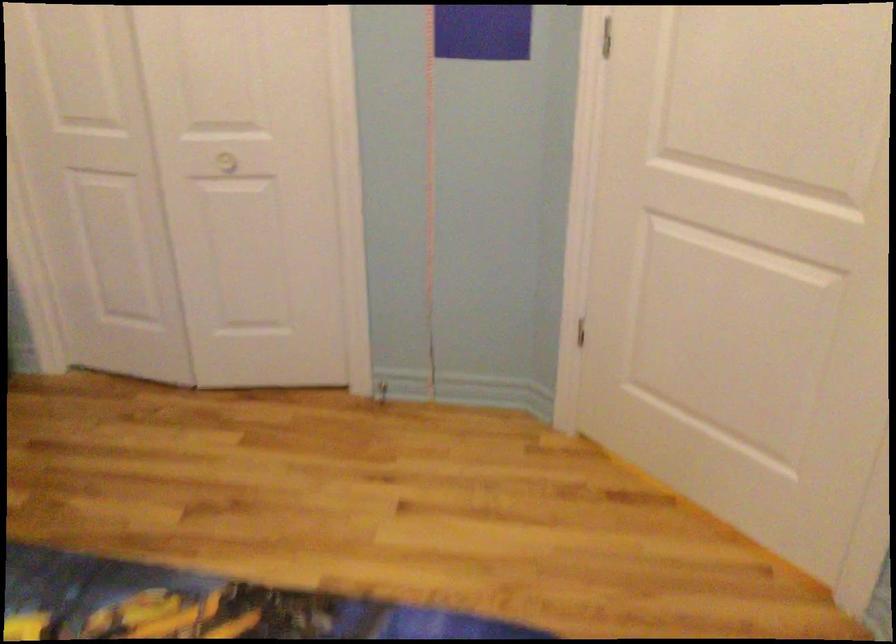
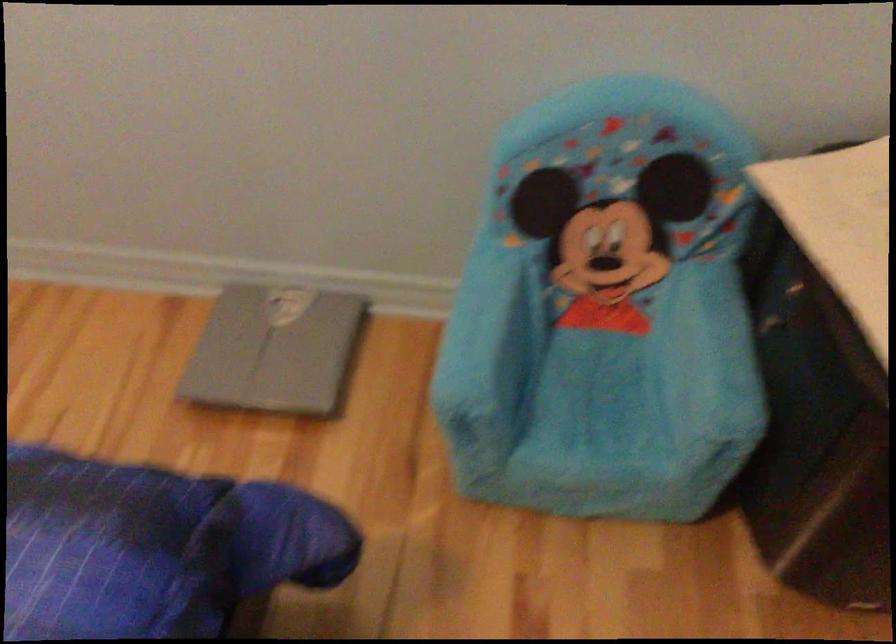
The first image is from the beginning of the video and the second image is from the end. How did the camera likely rotate when shooting the video?

The camera rotated toward right-down.